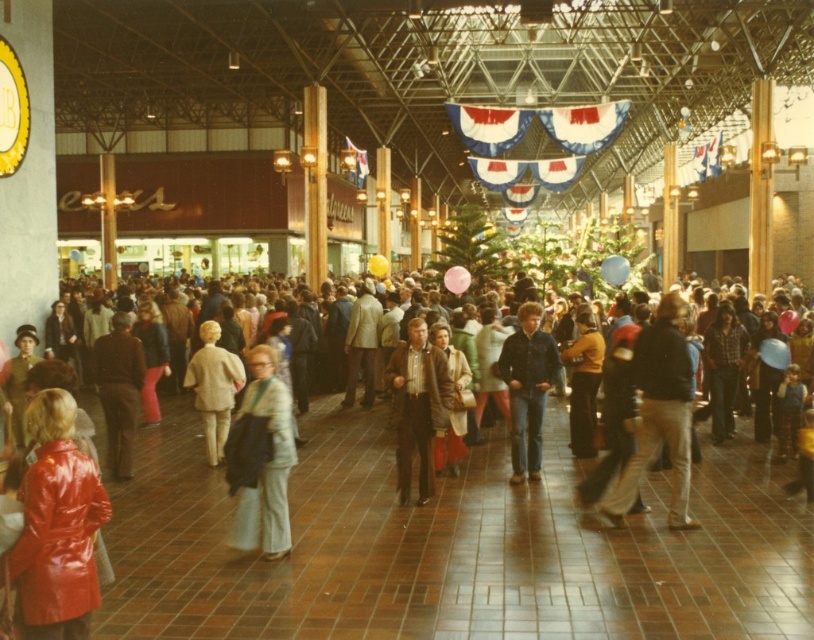
Which is in front, point (694, 522) or point (502, 353)?

Positioned in front is point (694, 522).

Is point (663, 371) behind point (517, 429)?

No, (663, 371) is closer to viewer.

Where is `light brown leather jacket at center`? This screenshot has height=640, width=814. light brown leather jacket at center is located at coordinates (659, 413).

Image resolution: width=814 pixels, height=640 pixels. Find the location of `light brown leather jacket at center`. light brown leather jacket at center is located at coordinates (659, 413).

Based on the photo, is shiny red coat at lower left behind brown leather jacket at center?

No, it is in front of brown leather jacket at center.

Find the location of a particular element. The width and height of the screenshot is (814, 640). shiny red coat at lower left is located at coordinates [x=57, y=525].

Which of these two, brown leather jacket at center or light beige coat at center, stands taller?

brown leather jacket at center

Is brown leather jacket at center to the right of light beige coat at center from the viewer's perspective?

Yes, brown leather jacket at center is to the right of light beige coat at center.

Does point (392, 364) come farther from viewer compared to point (208, 410)?

No, it is not.

Identify the location of brown leather jacket at center. The width and height of the screenshot is (814, 640). (418, 406).